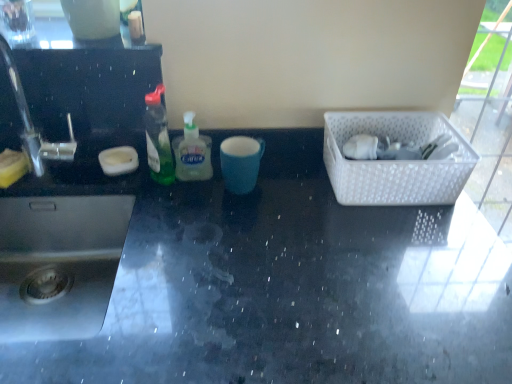
Question: Choose the correct answer: Is black glossy countertop at center inside white plastic basket at right or outside it?

Choices:
 (A) outside
 (B) inside

Answer: (A)

Question: From a real-world perspective, is black glossy countertop at center positioned above or below white plastic basket at right?

Choices:
 (A) below
 (B) above

Answer: (A)

Question: Considering the real-world distances, which object is farthest from the green translucent bottle at center, placed as the first bottle when sorted from left to right?

Choices:
 (A) translucent green liquid soap at center, marked as the second bottle in a left-to-right arrangement
 (B) white plastic basket at right
 (C) black glossy countertop at center

Answer: (B)

Question: Based on their relative distances, which object is nearer to the green translucent bottle at center, acting as the 2th bottle starting from the right?

Choices:
 (A) black glossy countertop at center
 (B) white plastic basket at right
 (C) translucent green liquid soap at center, marked as the first bottle in a right-to-left arrangement

Answer: (C)